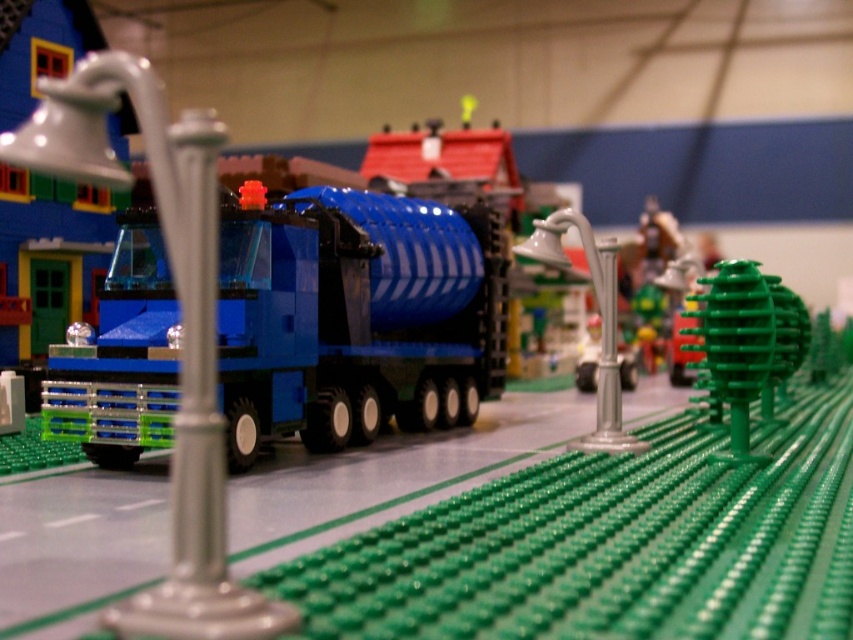
Can you confirm if matte blue plastic truck at center is wider than metallic silver faucet at center?

Indeed, matte blue plastic truck at center has a greater width compared to metallic silver faucet at center.

Is matte blue plastic truck at center above metallic silver faucet at center?

Indeed, matte blue plastic truck at center is positioned over metallic silver faucet at center.

Where is `matte blue plastic truck at center`? The width and height of the screenshot is (853, 640). matte blue plastic truck at center is located at coordinates (357, 316).

At what (x,y) coordinates should I click in order to perform the action: click on matte blue plastic truck at center. Please return your answer as a coordinate pair (x, y). Image resolution: width=853 pixels, height=640 pixels. Looking at the image, I should click on (357, 316).

Looking at this image, which of these two, green matte tree at center right or metallic silver faucet at center, stands shorter?

green matte tree at center right

At what (x,y) coordinates should I click in order to perform the action: click on green matte tree at center right. Please return your answer as a coordinate pair (x, y). Image resolution: width=853 pixels, height=640 pixels. Looking at the image, I should click on (743, 342).

Where is `green matte tree at center right`? green matte tree at center right is located at coordinates (743, 342).

Which of these two, matte blue plastic truck at center or green matte tree at center right, stands taller?

Standing taller between the two is matte blue plastic truck at center.

Is matte blue plastic truck at center in front of green matte tree at center right?

Yes, it is.

Image resolution: width=853 pixels, height=640 pixels. What do you see at coordinates (357, 316) in the screenshot?
I see `matte blue plastic truck at center` at bounding box center [357, 316].

Locate an element on the screen. This screenshot has height=640, width=853. matte blue plastic truck at center is located at coordinates (357, 316).